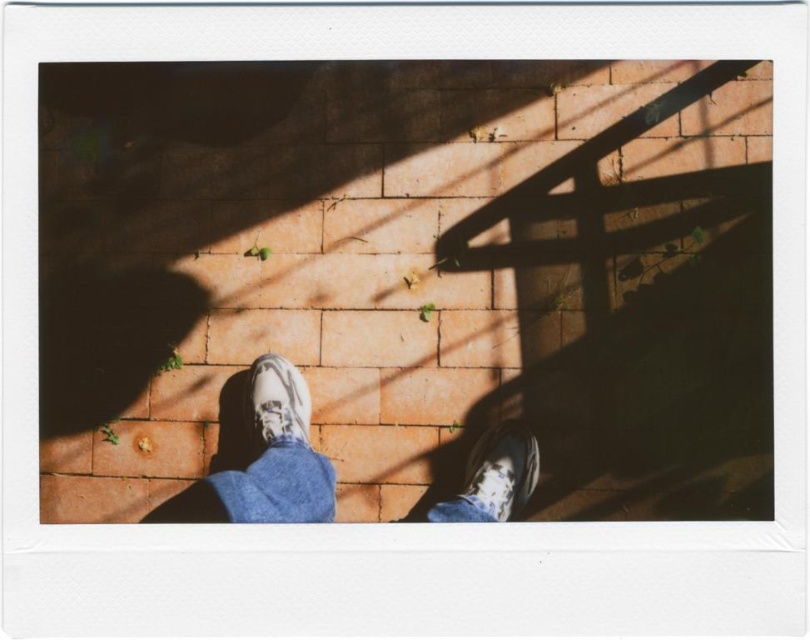
Question: Which of the following is the closest to the observer?

Choices:
 (A) (463, 515)
 (B) (467, 476)

Answer: (A)

Question: Which of the following is the closest to the observer?

Choices:
 (A) leather sneakers at center
 (B) white textured shoe at center

Answer: (A)

Question: Does leather sneakers at center lie in front of white textured shoe at center?

Choices:
 (A) yes
 (B) no

Answer: (A)

Question: Which object is farther from the camera taking this photo?

Choices:
 (A) white textured shoe at center
 (B) white matte shoe at lower center
 (C) leather sneakers at center

Answer: (A)

Question: Is leather sneakers at center wider than white textured shoe at center?

Choices:
 (A) yes
 (B) no

Answer: (A)

Question: Can you confirm if leather sneakers at center is thinner than white matte shoe at lower center?

Choices:
 (A) no
 (B) yes

Answer: (A)